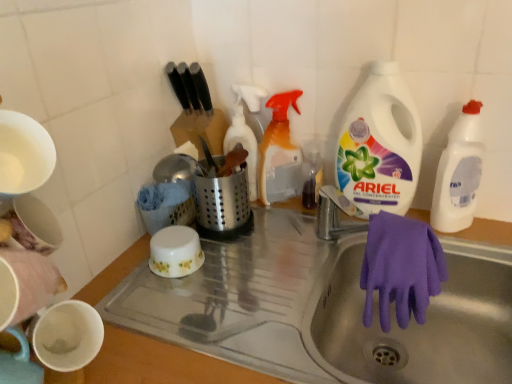
Where is `purple rubber glove at lower right`? The height and width of the screenshot is (384, 512). purple rubber glove at lower right is located at coordinates (323, 309).

At what (x,y) coordinates should I click in order to perform the action: click on purple rubber glove at sink. Please return your answer as a coordinate pair (x, y). Image resolution: width=512 pixels, height=384 pixels. Looking at the image, I should click on (401, 268).

You are a GUI agent. You are given a task and a screenshot of the screen. Output one action in this format:
    pyautogui.click(x=<x>, y=<y>)
    Task: Click on the translucent plastic spray bottle at upper center, positioned as the first cleaning product in left-to-right order
    The image size is (512, 384).
    Given the screenshot: What is the action you would take?
    pyautogui.click(x=245, y=130)

In order to face translucent plastic spray bottle at center, acting as the 3th cleaning product starting from the right, should I rotate leftwards or rightwards?

It's best to rotate right around 3.898 degrees.

What do you see at coordinates (279, 153) in the screenshot?
I see `translucent plastic spray bottle at center, acting as the 3th cleaning product starting from the right` at bounding box center [279, 153].

The width and height of the screenshot is (512, 384). What are the coordinates of `purple rubber glove at lower right` in the screenshot? It's located at (323, 309).

Can purple rubber glove at sink be found inside translucent plastic spray bottle at center, which is the second cleaning product from left to right?

Actually, purple rubber glove at sink is outside translucent plastic spray bottle at center, which is the second cleaning product from left to right.

This screenshot has width=512, height=384. I want to click on glove in front of the translucent plastic spray bottle at center, which is the second cleaning product from left to right, so click(401, 268).

From the image's perspective, would you say translucent plastic spray bottle at center, acting as the 3th cleaning product starting from the right, is shown under purple rubber glove at sink?

Actually, translucent plastic spray bottle at center, acting as the 3th cleaning product starting from the right, appears above purple rubber glove at sink in the image.

From the image's perspective, which is below, purple rubber glove at sink or purple rubber glove at lower right?

purple rubber glove at lower right is shown below in the image.

Choose the correct answer: Is purple rubber glove at sink inside purple rubber glove at lower right or outside it?

purple rubber glove at sink is located inside purple rubber glove at lower right.

Is purple rubber glove at sink positioned with its back to purple rubber glove at lower right?

No.

Where is `sink below the purple rubber glove at sink (from a real-world perspective)`? This screenshot has width=512, height=384. sink below the purple rubber glove at sink (from a real-world perspective) is located at coordinates (323, 309).

Which of these two, translucent plastic spray bottle at center, which is the second cleaning product from left to right, or purple rubber glove at lower right, is thinner?

With smaller width is translucent plastic spray bottle at center, which is the second cleaning product from left to right.

From a real-world perspective, between translucent plastic spray bottle at center, which is the second cleaning product from left to right, and purple rubber glove at lower right, who is vertically lower?

In real-world perspective, purple rubber glove at lower right is lower.

Does translucent plastic spray bottle at center, acting as the 3th cleaning product starting from the right, have a smaller size compared to purple rubber glove at lower right?

Correct, translucent plastic spray bottle at center, acting as the 3th cleaning product starting from the right, occupies less space than purple rubber glove at lower right.

Is translucent plastic spray bottle at center, which is the second cleaning product from left to right, located outside purple rubber glove at lower right?

Yes, translucent plastic spray bottle at center, which is the second cleaning product from left to right, is not within purple rubber glove at lower right.

How many degrees apart are the facing directions of white plastic bottle at upper right, the second cleaning product viewed from the right, and translucent plastic spray bottle at upper center, which ranks as the fourth cleaning product in right-to-left order?

They differ by 0.00064 degrees in their facing directions.

Is point (401, 139) closer or farther from the camera than point (251, 198)?

Point (401, 139) is positioned closer to the camera compared to point (251, 198).

Which object is further away from the camera taking this photo, white plastic bottle at upper right, the second cleaning product viewed from the right, or translucent plastic spray bottle at upper center, which ranks as the fourth cleaning product in right-to-left order?

translucent plastic spray bottle at upper center, which ranks as the fourth cleaning product in right-to-left order, is further away from the camera.

From the image's perspective, does white plastic bottle at upper right, arranged as the 3th cleaning product when viewed from the left, appear lower than translucent plastic spray bottle at upper center, positioned as the first cleaning product in left-to-right order?

Incorrect, from the image's perspective, white plastic bottle at upper right, arranged as the 3th cleaning product when viewed from the left, is higher than translucent plastic spray bottle at upper center, positioned as the first cleaning product in left-to-right order.

Measure the distance between translucent plastic spray bottle at center, which is the second cleaning product from left to right, and white plastic bottle at upper right, arranged as the 3th cleaning product when viewed from the left.

The distance of translucent plastic spray bottle at center, which is the second cleaning product from left to right, from white plastic bottle at upper right, arranged as the 3th cleaning product when viewed from the left, is 7.30 inches.

You are a GUI agent. You are given a task and a screenshot of the screen. Output one action in this format:
    pyautogui.click(x=<x>, y=<y>)
    Task: Click on the 1st cleaning product to the right of the translucent plastic spray bottle at center, which is the second cleaning product from left to right, counting from the anchor's position
    Image resolution: width=512 pixels, height=384 pixels.
    Given the screenshot: What is the action you would take?
    pyautogui.click(x=380, y=144)

Looking at their sizes, would you say translucent plastic spray bottle at center, acting as the 3th cleaning product starting from the right, is wider or thinner than white plastic bottle at upper right, the second cleaning product viewed from the right?

Considering their sizes, translucent plastic spray bottle at center, acting as the 3th cleaning product starting from the right, looks broader than white plastic bottle at upper right, the second cleaning product viewed from the right.

From the picture: Is translucent plastic spray bottle at center, acting as the 3th cleaning product starting from the right, not within white plastic bottle at upper right, arranged as the 3th cleaning product when viewed from the left?

translucent plastic spray bottle at center, acting as the 3th cleaning product starting from the right, is positioned outside white plastic bottle at upper right, arranged as the 3th cleaning product when viewed from the left.

Is purple rubber glove at lower right bigger than translucent plastic spray bottle at upper center, which ranks as the fourth cleaning product in right-to-left order?

Indeed, purple rubber glove at lower right has a larger size compared to translucent plastic spray bottle at upper center, which ranks as the fourth cleaning product in right-to-left order.

Is purple rubber glove at lower right next to translucent plastic spray bottle at upper center, positioned as the first cleaning product in left-to-right order, and touching it?

No, purple rubber glove at lower right is not in contact with translucent plastic spray bottle at upper center, positioned as the first cleaning product in left-to-right order.

Which of these two, purple rubber glove at lower right or translucent plastic spray bottle at upper center, which ranks as the fourth cleaning product in right-to-left order, is wider?

purple rubber glove at lower right is wider.

Could you tell me if purple rubber glove at lower right is facing translucent plastic spray bottle at upper center, which ranks as the fourth cleaning product in right-to-left order?

No.

Considering the sizes of objects purple rubber glove at sink and white plastic bottle at upper right, the second cleaning product viewed from the right, in the image provided, who is thinner, purple rubber glove at sink or white plastic bottle at upper right, the second cleaning product viewed from the right,?

Thinner between the two is purple rubber glove at sink.

Would you say purple rubber glove at sink is a long distance from white plastic bottle at upper right, the second cleaning product viewed from the right?

Actually, purple rubber glove at sink and white plastic bottle at upper right, the second cleaning product viewed from the right, are a little close together.

Does purple rubber glove at sink turn towards white plastic bottle at upper right, the second cleaning product viewed from the right?

No, purple rubber glove at sink is not oriented towards white plastic bottle at upper right, the second cleaning product viewed from the right.

Locate an element on the screen. The width and height of the screenshot is (512, 384). cleaning product that is the 1st one when counting leftward from the purple rubber glove at sink is located at coordinates (279, 153).

The image size is (512, 384). What are the coordinates of `glove above the purple rubber glove at lower right (from a real-world perspective)` in the screenshot? It's located at (401, 268).

Looking at the image, which one is located closer to purple rubber glove at lower right, translucent plastic spray bottle at center, acting as the 3th cleaning product starting from the right, or translucent plastic spray bottle at upper center, positioned as the first cleaning product in left-to-right order?

Based on the image, translucent plastic spray bottle at center, acting as the 3th cleaning product starting from the right, appears to be nearer to purple rubber glove at lower right.

From the image, which object appears to be nearer to purple rubber glove at sink, translucent plastic spray bottle at center, acting as the 3th cleaning product starting from the right, or white plastic bottle at upper right, which is the fourth cleaning product from left to right?

white plastic bottle at upper right, which is the fourth cleaning product from left to right.

Considering their positions, is purple rubber glove at sink positioned closer to translucent plastic spray bottle at center, acting as the 3th cleaning product starting from the right, than translucent plastic spray bottle at upper center, positioned as the first cleaning product in left-to-right order?

translucent plastic spray bottle at upper center, positioned as the first cleaning product in left-to-right order, is closer to translucent plastic spray bottle at center, acting as the 3th cleaning product starting from the right.

Considering their positions, is purple rubber glove at lower right positioned closer to purple rubber glove at sink than white plastic bottle at upper right, which is the fourth cleaning product from left to right?

Based on the image, purple rubber glove at lower right appears to be nearer to purple rubber glove at sink.

When comparing their distances from translucent plastic spray bottle at center, which is the second cleaning product from left to right, does purple rubber glove at lower right or purple rubber glove at sink seem closer?

purple rubber glove at lower right lies closer to translucent plastic spray bottle at center, which is the second cleaning product from left to right, than the other object.

Which object lies further to the anchor point white plastic bottle at upper right, which is the fourth cleaning product from left to right, purple rubber glove at lower right or translucent plastic spray bottle at upper center, which ranks as the fourth cleaning product in right-to-left order?

Among the two, translucent plastic spray bottle at upper center, which ranks as the fourth cleaning product in right-to-left order, is located further to white plastic bottle at upper right, which is the fourth cleaning product from left to right.

In the scene shown: Considering their positions, is purple rubber glove at lower right positioned closer to white plastic bottle at upper right, arranged as the 3th cleaning product when viewed from the left, than translucent plastic spray bottle at center, acting as the 3th cleaning product starting from the right?

translucent plastic spray bottle at center, acting as the 3th cleaning product starting from the right, is positioned closer to the anchor white plastic bottle at upper right, arranged as the 3th cleaning product when viewed from the left.

Looking at the image, which one is located further to translucent plastic spray bottle at upper center, positioned as the first cleaning product in left-to-right order, white plastic bottle at upper right, which is the fourth cleaning product from left to right, or white plastic bottle at upper right, the second cleaning product viewed from the right?

The object further to translucent plastic spray bottle at upper center, positioned as the first cleaning product in left-to-right order, is white plastic bottle at upper right, which is the fourth cleaning product from left to right.

This screenshot has width=512, height=384. I want to click on glove positioned between purple rubber glove at lower right and translucent plastic spray bottle at center, acting as the 3th cleaning product starting from the right, from near to far, so click(x=401, y=268).

This screenshot has width=512, height=384. What are the coordinates of `glove between translucent plastic spray bottle at upper center, positioned as the first cleaning product in left-to-right order, and white plastic bottle at upper right, which is the fourth cleaning product from left to right, from left to right` in the screenshot? It's located at (401, 268).

Find the location of a particular element. The width and height of the screenshot is (512, 384). glove between translucent plastic spray bottle at center, which is the second cleaning product from left to right, and white plastic bottle at upper right, which is the fourth cleaning product from left to right is located at coordinates (401, 268).

You are a GUI agent. You are given a task and a screenshot of the screen. Output one action in this format:
    pyautogui.click(x=<x>, y=<y>)
    Task: Click on the cleaning product situated between translucent plastic spray bottle at center, which is the second cleaning product from left to right, and white plastic bottle at upper right, which is counted as the 1th cleaning product, starting from the right, from left to right
    
    Given the screenshot: What is the action you would take?
    pyautogui.click(x=380, y=144)